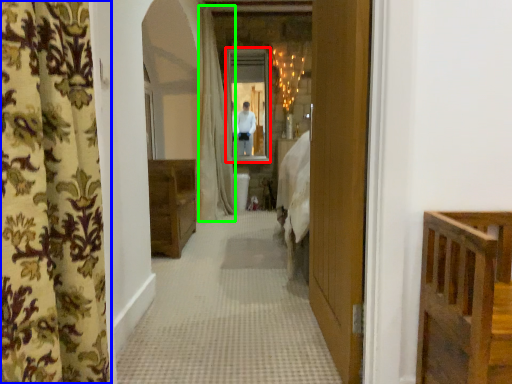
Question: Estimate the real-world distances between objects in this image. Which object is farther from mirror (highlighted by a red box), curtain (highlighted by a blue box) or shower curtain (highlighted by a green box)?

Choices:
 (A) curtain
 (B) shower curtain

Answer: (A)